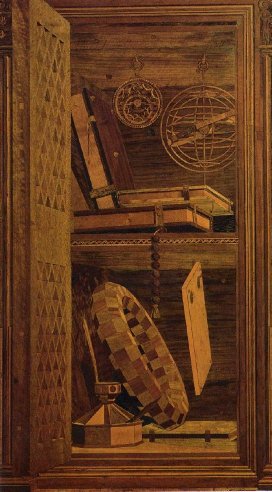
Locate an element on the screen. The height and width of the screenshot is (492, 272). painting is located at coordinates (209, 142).